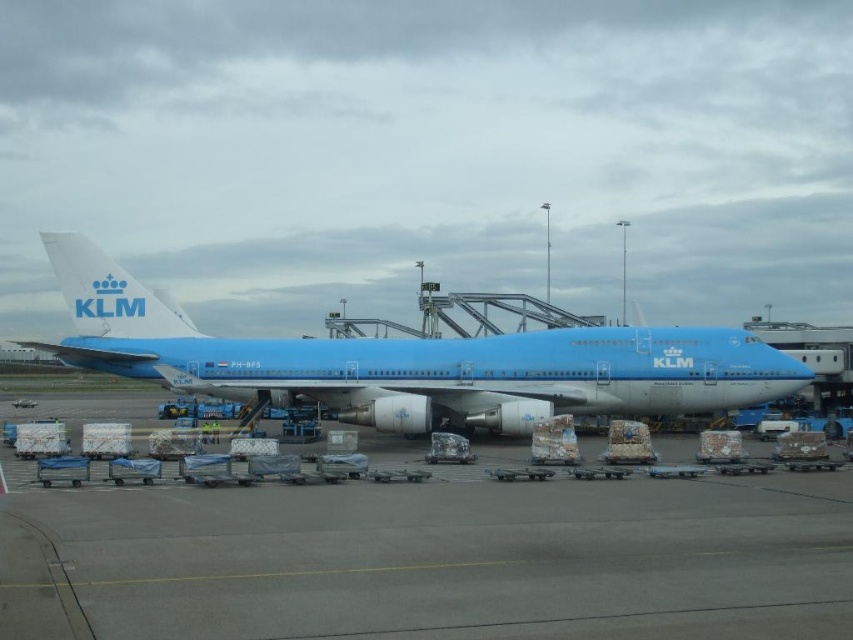
You are a ground crew member observing the blue matte airplane at center parked at an airport gate. You notice the blue matte tarmac at center. From the perspective of someone standing at the airport gate, which object is positioned lower?

The blue matte tarmac at center is below the blue matte airplane at center, so the blue matte tarmac at center is positioned lower.

You are a ground crew member trying to maneuver a forklift between the blue matte tarmac at center and the blue matte airplane at center. Considering the space available, can you safely move the forklift sideways without hitting either object?

The blue matte tarmac at center is narrower than the blue matte airplane at center, so there might not be enough space to safely maneuver the forklift sideways between them. Proceed with caution and ensure clearance.

You are a ground crew member standing at the camera position. You need to move a cargo pallet from the plane to a storage area located 10 meters away from the camera. Can you reach the point marked at coordinates point (766, 637) before reaching the storage area?

The point marked at coordinates point (766, 637) is only 6.43 meters away from the camera, which is closer than the storage area located 10 meters away. Therefore, you can reach the point before reaching the storage area.